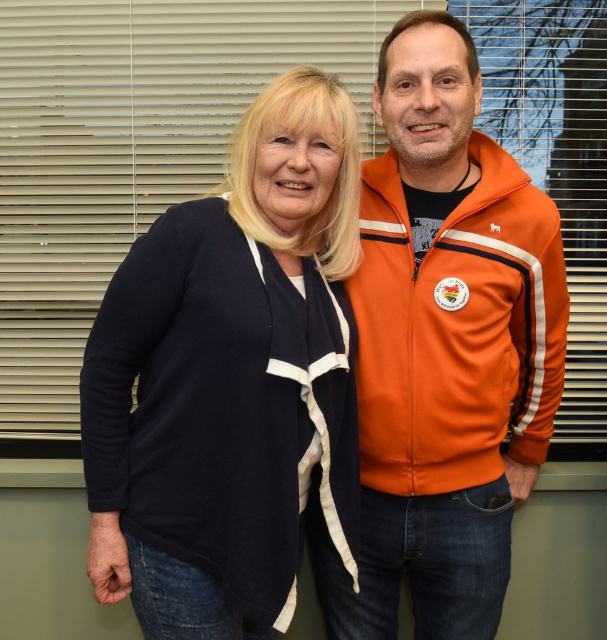
You are trying to decide whether to hang a decorative banner between the matte plastic blinds at upper center and the orange fleece jacket at center. Based on their widths, which object should the banner be placed closer to for it to fit better?

The matte plastic blinds at upper center has a larger width than the orange fleece jacket at center, so the banner should be placed closer to the matte plastic blinds at upper center to ensure it fits better.

Based on the scene description, what are the coordinates of the matte plastic blinds at upper center?

The matte plastic blinds at upper center are located at coordinates point [129,148].